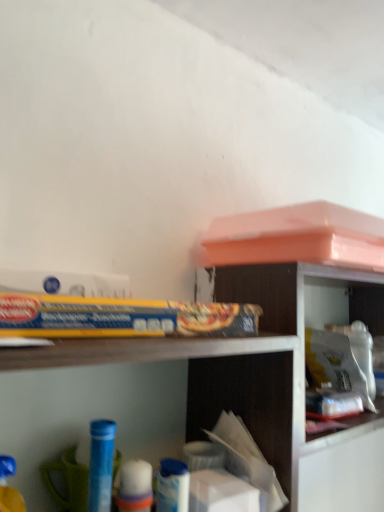
Question: From the image's perspective, does white plastic container at upper right appear higher than blue plastic tube at lower left, positioned as the 2th toy in front-to-back order?

Choices:
 (A) yes
 (B) no

Answer: (A)

Question: Is the depth of white plastic container at upper right greater than that of blue plastic tube at lower left, which ranks as the 1th toy in back-to-front order?

Choices:
 (A) yes
 (B) no

Answer: (A)

Question: Is white plastic container at upper right in front of blue plastic tube at lower left, which is counted as the 2th toy, starting from the left?

Choices:
 (A) yes
 (B) no

Answer: (B)

Question: Is white plastic container at upper right facing towards blue plastic tube at lower left, which is counted as the 1th toy, starting from the right?

Choices:
 (A) no
 (B) yes

Answer: (A)

Question: Does white plastic container at upper right have a larger size compared to blue plastic tube at lower left, which ranks as the 1th toy in back-to-front order?

Choices:
 (A) no
 (B) yes

Answer: (B)

Question: From a real-world perspective, is white plastic container at upper right over blue plastic tube at lower left, which is counted as the 2th toy, starting from the left?

Choices:
 (A) yes
 (B) no

Answer: (A)

Question: Is blue plastic toy at lower left, positioned as the 2th toy in back-to-front order, directly adjacent to blue plastic tube at lower left, which is counted as the 1th toy, starting from the right?

Choices:
 (A) yes
 (B) no

Answer: (B)

Question: From a real-world perspective, does blue plastic toy at lower left, which appears as the 1th toy when viewed from the front, stand above blue plastic tube at lower left, which ranks as the 1th toy in back-to-front order?

Choices:
 (A) yes
 (B) no

Answer: (B)

Question: From the image's perspective, is blue plastic toy at lower left, which is the 1th toy in left-to-right order, below blue plastic tube at lower left, which is counted as the 1th toy, starting from the right?

Choices:
 (A) yes
 (B) no

Answer: (B)

Question: Can blue plastic tube at lower left, which is counted as the 1th toy, starting from the right, be found inside blue plastic toy at lower left, positioned as the 2th toy in back-to-front order?

Choices:
 (A) no
 (B) yes

Answer: (A)

Question: Is blue plastic toy at lower left, which appears as the 1th toy when viewed from the front, smaller than blue plastic tube at lower left, which ranks as the 1th toy in back-to-front order?

Choices:
 (A) yes
 (B) no

Answer: (A)

Question: Is blue plastic toy at lower left, which is the 1th toy in left-to-right order, positioned behind blue plastic tube at lower left, which is counted as the 2th toy, starting from the left?

Choices:
 (A) yes
 (B) no

Answer: (B)

Question: Is wooden bookshelf at upper right not close to wooden shelf at upper center?

Choices:
 (A) no
 (B) yes

Answer: (A)